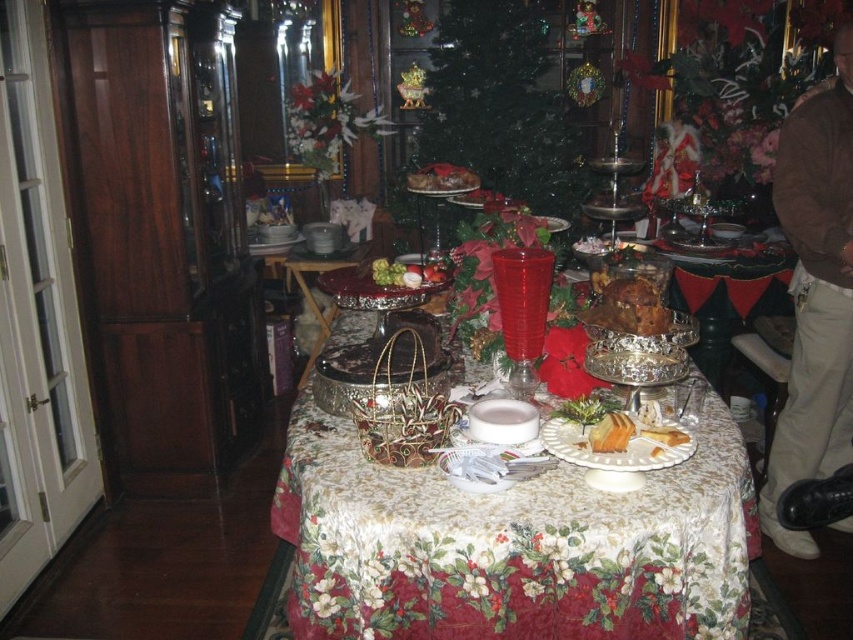
Question: Estimate the real-world distances between objects in this image. Which object is farther from the brown sweater at upper right?

Choices:
 (A) green matte grapes at center
 (B) golden brown cake at center
 (C) shiny silver cake stand at center

Answer: (A)

Question: Does brown sweater at upper right lie behind green matte grapes at center?

Choices:
 (A) no
 (B) yes

Answer: (A)

Question: From the image, what is the correct spatial relationship of brown sweater at upper right in relation to golden cake at center?

Choices:
 (A) below
 (B) above

Answer: (B)

Question: Is the position of floral-patterned fabric at center less distant than that of green textured christmas tree at center?

Choices:
 (A) no
 (B) yes

Answer: (B)

Question: Which object appears farthest from the camera in this image?

Choices:
 (A) golden cake at center
 (B) yellow cake at center

Answer: (B)

Question: Considering the real-world distances, which object is closest to the yellow cake at center?

Choices:
 (A) floral-patterned fabric at center
 (B) shiny silver cake stand at center

Answer: (A)